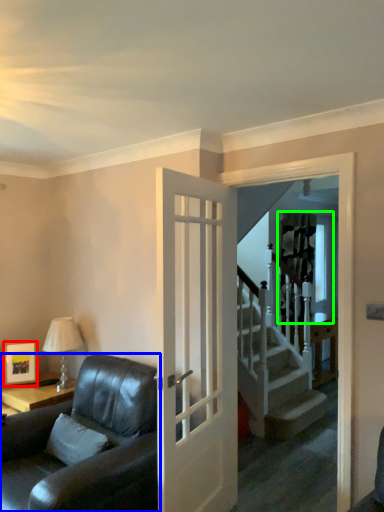
Question: Considering the real-world distances, which object is farthest from picture frame (highlighted by a red box)? studio couch (highlighted by a blue box) or window (highlighted by a green box)?

Choices:
 (A) studio couch
 (B) window

Answer: (B)